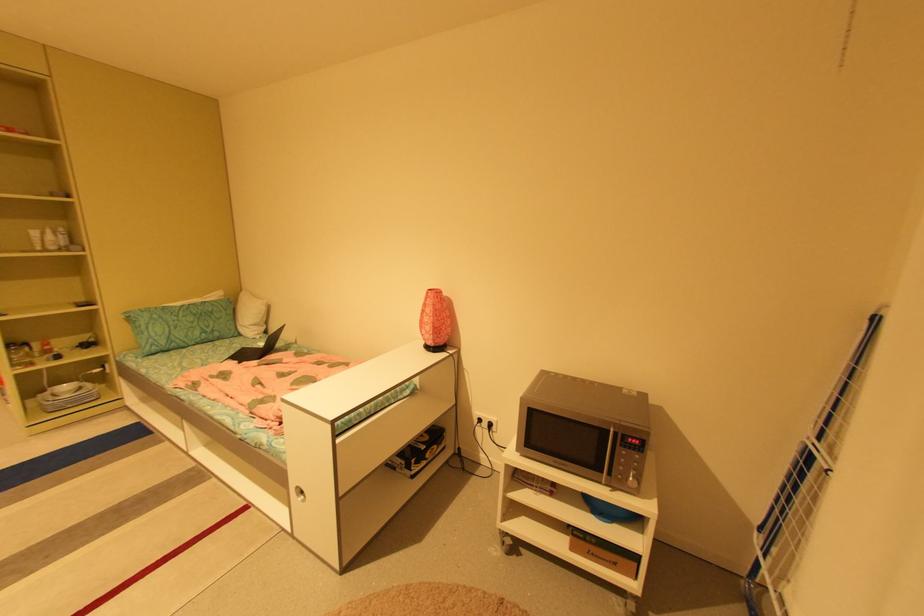
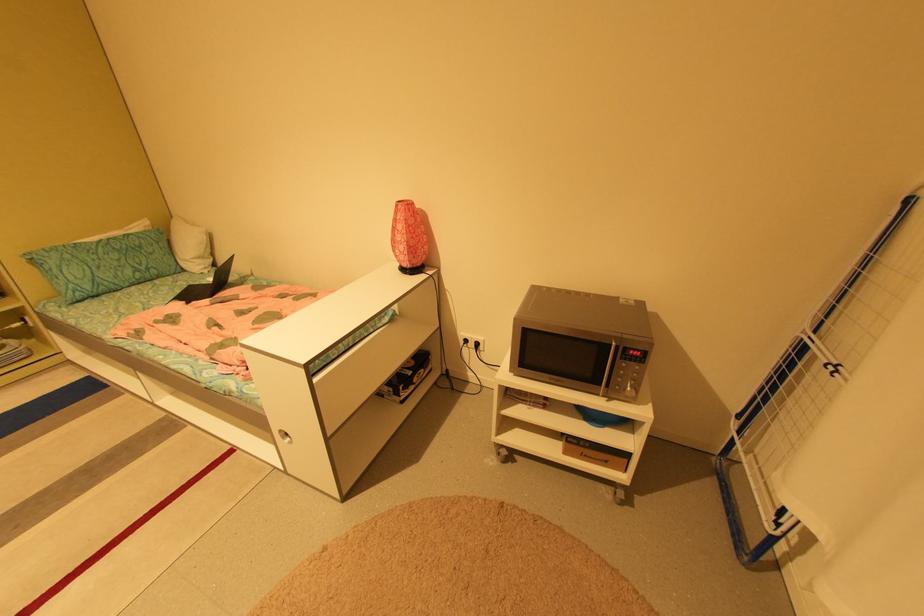
The point at [247,334] is marked in the first image. Where is the corresponding point in the second image?

(190, 270)